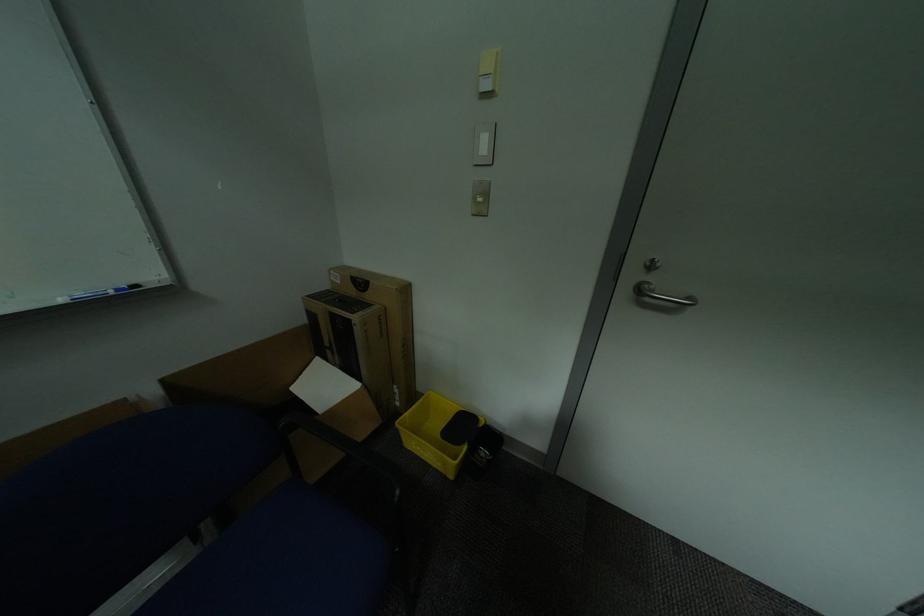
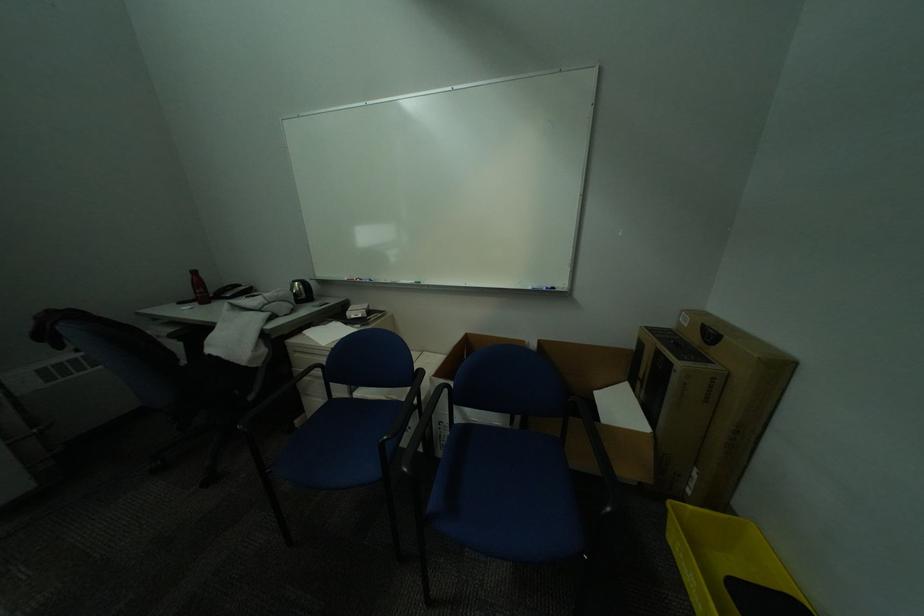
Find the pixel in the second image that matches point (343, 280) in the first image.

(691, 321)